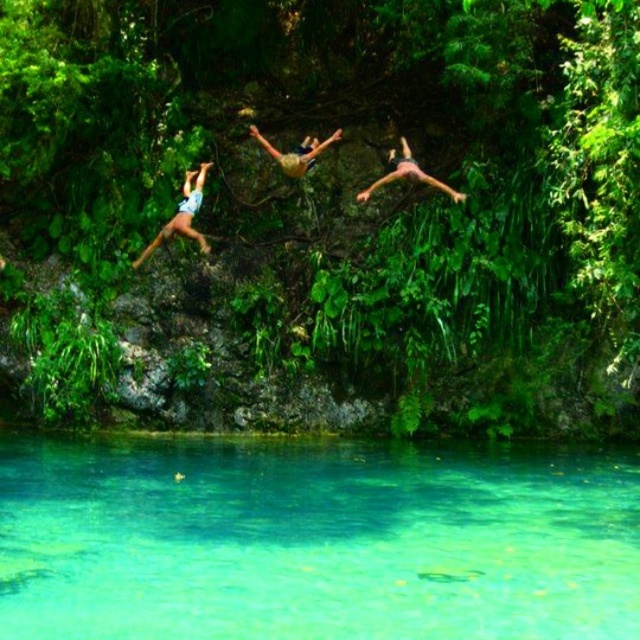
You are standing on a diving platform and see the transparent water at lower center and camouflage shorts at center. Which object is positioned to the right of the other?

The transparent water at lower center is to the right of camouflage shorts at center.

You are standing at the center of the image. Which direction should you move to locate the light blue denim shorts at left?

You should move to the left to locate the light blue denim shorts at left since they are positioned at the left side of the image.

You are a photographer trying to capture the best shot of the light blue denim shorts at left and camouflage shorts at center. Which of these two shorts is positioned closer to you, the photographer?

The light blue denim shorts at left is closer to the viewer than camouflage shorts at center, so the photographer should focus on capturing the light blue denim shorts at left first as it is nearer.